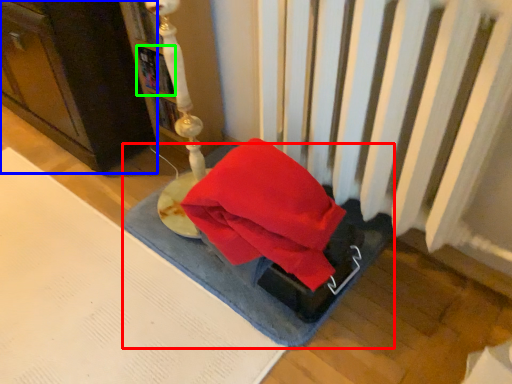
Question: Which object is the closest to the yoga mat (highlighted by a red box)? Choose among these: furniture (highlighted by a blue box) or book (highlighted by a green box).

Choices:
 (A) furniture
 (B) book

Answer: (A)